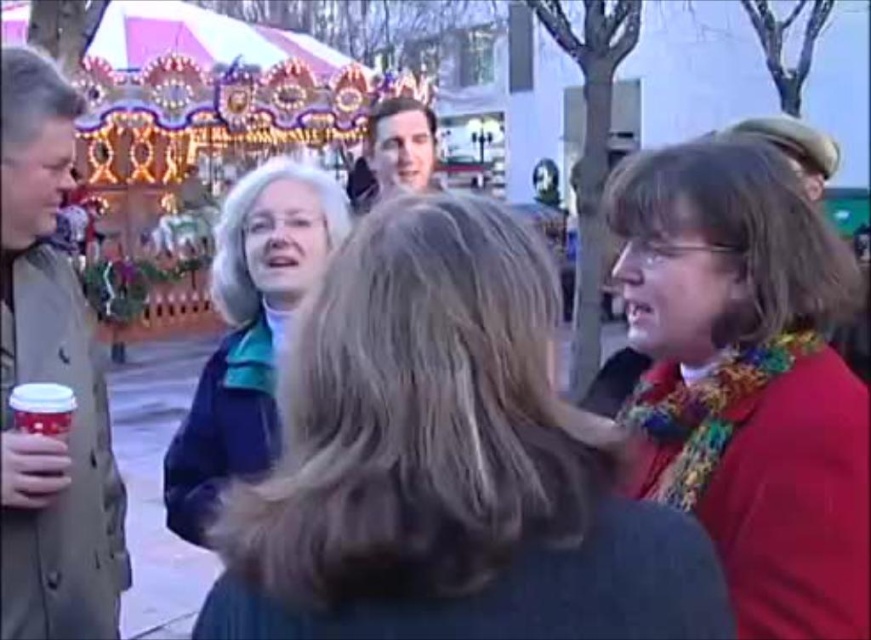
Question: Observing the image, what is the correct spatial positioning of blue woolen sweater at center in reference to red matte scarf at right?

Choices:
 (A) right
 (B) left

Answer: (B)

Question: Can you confirm if smooth skin face at center is positioned to the right of matte red cup at lower left?

Choices:
 (A) no
 (B) yes

Answer: (B)

Question: Estimate the real-world distances between objects in this image. Which object is closer to the blue fabric jacket at center?

Choices:
 (A) blue woolen sweater at center
 (B) brown leather jacket at left
 (C) smooth skin face at center
 (D) matte red cup at lower left

Answer: (B)

Question: Which point appears farthest from the camera in this image?

Choices:
 (A) (845, 584)
 (B) (362, 184)
 (C) (71, 390)
 (D) (107, 536)

Answer: (B)

Question: Is red matte scarf at right above blue fabric jacket at center?

Choices:
 (A) yes
 (B) no

Answer: (B)

Question: Which object appears farthest from the camera in this image?

Choices:
 (A) smooth skin face at center
 (B) brown leather jacket at left
 (C) matte red cup at lower left

Answer: (A)